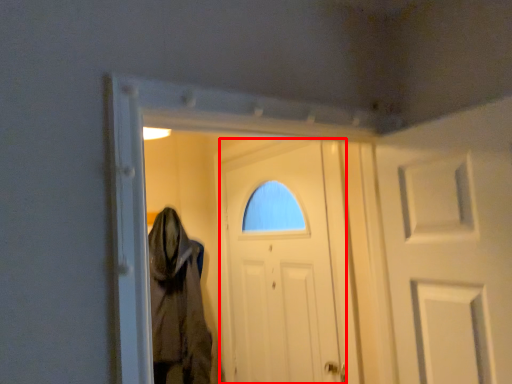
Question: From the image's perspective, where is door (annotated by the red box) located relative to cloak?

Choices:
 (A) above
 (B) below

Answer: (A)